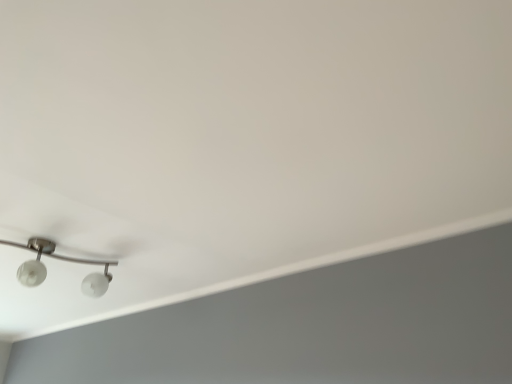
Where is `satin nickel light fixture at upper left`? This screenshot has width=512, height=384. satin nickel light fixture at upper left is located at coordinates (59, 259).

Measure the distance between point (84, 283) and camera.

6.91 feet.

This screenshot has height=384, width=512. Describe the element at coordinates (59, 259) in the screenshot. I see `satin nickel light fixture at upper left` at that location.

Find the location of `satin nickel light fixture at upper left`. satin nickel light fixture at upper left is located at coordinates (59, 259).